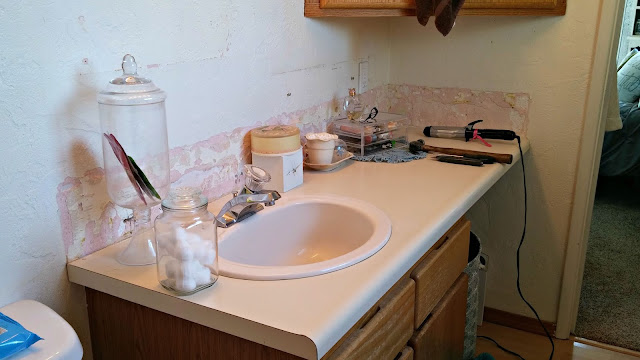
Locate an element on the screen. wire/cable is located at coordinates (521, 177).